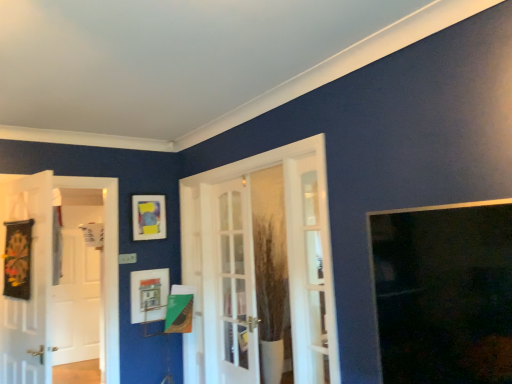
This screenshot has width=512, height=384. What do you see at coordinates (149, 295) in the screenshot? I see `matte white picture frame at center, acting as the first picture frame starting from the bottom` at bounding box center [149, 295].

Describe the element at coordinates (30, 280) in the screenshot. I see `black fabric banner at left, which is counted as the first door, starting from the left` at that location.

Measure the distance between point (42, 330) and camera.

They are 2.74 meters apart.

What do you see at coordinates (444, 294) in the screenshot?
I see `transparent glass window at upper right` at bounding box center [444, 294].

Measure the distance between matte plastic picture frame at upper left, which is the 1th picture frame in top-to-bottom order, and camera.

3.68 meters.

Identify the location of matte white picture frame at center, which is counted as the 2th picture frame, starting from the top. point(149,295).

Can you confirm if black fabric banner at left, which is the third door in right-to-left order, is taller than matte plastic picture frame at upper left, the 2th picture frame in the bottom-to-top sequence?

→ Yes, black fabric banner at left, which is the third door in right-to-left order, is taller than matte plastic picture frame at upper left, the 2th picture frame in the bottom-to-top sequence.

From the image's perspective, is black fabric banner at left, which is counted as the first door, starting from the left, under matte plastic picture frame at upper left, which is the 1th picture frame in top-to-bottom order?

Correct, black fabric banner at left, which is counted as the first door, starting from the left, appears lower than matte plastic picture frame at upper left, which is the 1th picture frame in top-to-bottom order, in the image.

Looking at this image, is matte plastic picture frame at upper left, which is the 1th picture frame in top-to-bottom order, surrounded by black fabric banner at left, which is the third door in right-to-left order?

No.

Is white glossy screen door at left wider than white glass door at center, the second door viewed from the left?

In fact, white glossy screen door at left might be narrower than white glass door at center, the second door viewed from the left.

Where is `screen door behind the white glass door at center, the second door viewed from the left`? screen door behind the white glass door at center, the second door viewed from the left is located at coordinates (80, 281).

Does point (81, 189) come farther from viewer compared to point (234, 283)?

That is True.

Is white glossy screen door at left oriented towards white glass door at center, the second door viewed from the left?

Yes, white glossy screen door at left is facing white glass door at center, the second door viewed from the left.

Is point (38, 291) positioned before point (72, 266)?

Yes, point (38, 291) is in front of point (72, 266).

From the image's perspective, is black fabric banner at left, which is counted as the first door, starting from the left, positioned above or below white glossy screen door at left?

black fabric banner at left, which is counted as the first door, starting from the left, is situated higher than white glossy screen door at left in the image.

The image size is (512, 384). What are the coordinates of `screen door below the black fabric banner at left, which is the third door in right-to-left order (from a real-world perspective)` in the screenshot? It's located at (80, 281).

Is transparent glass window at upper right to the left or to the right of matte plastic picture frame at upper left, which is the 1th picture frame in top-to-bottom order, in the image?

Based on their positions, transparent glass window at upper right is located to the right of matte plastic picture frame at upper left, which is the 1th picture frame in top-to-bottom order.

From the image's perspective, between transparent glass window at upper right and matte plastic picture frame at upper left, the 2th picture frame in the bottom-to-top sequence, who is located below?

transparent glass window at upper right is shown below in the image.

Find the location of `window that is under the matte plastic picture frame at upper left, which is the 1th picture frame in top-to-bottom order (from a real-world perspective)`. window that is under the matte plastic picture frame at upper left, which is the 1th picture frame in top-to-bottom order (from a real-world perspective) is located at coordinates click(x=444, y=294).

Considering the positions of objects white glass door at center, the third door in the left-to-right sequence, and white glass door at center, the second door viewed from the left, in the image provided, who is in front, white glass door at center, the third door in the left-to-right sequence, or white glass door at center, the second door viewed from the left,?

white glass door at center, the third door in the left-to-right sequence, is closer to the camera.

I want to click on door below the white glass door at center, the third door in the left-to-right sequence (from a real-world perspective), so click(234, 284).

Considering the positions of objects white glass door at center, the third door in the left-to-right sequence, and white glass door at center, the second door viewed from the left, in the image provided, who is more to the right, white glass door at center, the third door in the left-to-right sequence, or white glass door at center, the second door viewed from the left,?

white glass door at center, the third door in the left-to-right sequence, is more to the right.

In terms of width, does white glossy screen door at left look wider or thinner when compared to matte white picture frame at center, acting as the first picture frame starting from the bottom?

Considering their sizes, white glossy screen door at left looks slimmer than matte white picture frame at center, acting as the first picture frame starting from the bottom.

Is white glossy screen door at left completely or partially outside of matte white picture frame at center, which is counted as the 2th picture frame, starting from the top?

Indeed, white glossy screen door at left is completely outside matte white picture frame at center, which is counted as the 2th picture frame, starting from the top.

How much distance is there between white glossy screen door at left and matte white picture frame at center, which is counted as the 2th picture frame, starting from the top?

white glossy screen door at left and matte white picture frame at center, which is counted as the 2th picture frame, starting from the top, are 5.52 feet apart.

From a real-world perspective, is white glossy screen door at left positioned above or below matte white picture frame at center, which is counted as the 2th picture frame, starting from the top?

white glossy screen door at left is below matte white picture frame at center, which is counted as the 2th picture frame, starting from the top.

From a real-world perspective, is matte white picture frame at center, which is counted as the 2th picture frame, starting from the top, under transparent glass window at upper right?

Yes, from a real-world perspective, matte white picture frame at center, which is counted as the 2th picture frame, starting from the top, is below transparent glass window at upper right.

Do you think matte white picture frame at center, acting as the first picture frame starting from the bottom, is within transparent glass window at upper right, or outside of it?

matte white picture frame at center, acting as the first picture frame starting from the bottom, is spatially situated outside transparent glass window at upper right.

Can you tell me how much matte white picture frame at center, which is counted as the 2th picture frame, starting from the top, and transparent glass window at upper right differ in facing direction?

91.7 degrees separate the facing orientations of matte white picture frame at center, which is counted as the 2th picture frame, starting from the top, and transparent glass window at upper right.

Is matte white picture frame at center, which is counted as the 2th picture frame, starting from the top, behind transparent glass window at upper right?

Yes, it is.

The width and height of the screenshot is (512, 384). In order to click on the 2nd picture frame behind the black fabric banner at left, which is the third door in right-to-left order, starting your count from the anchor in this screenshot , I will do `click(148, 217)`.

In the image, there is a white glass door at center, the second door viewed from the left. Where is `screen door below it (from a real-world perspective)`? screen door below it (from a real-world perspective) is located at coordinates (80, 281).

From the image, which object appears to be nearer to white glass door at center, which is the 2th door in right-to-left order, matte plastic picture frame at upper left, the 2th picture frame in the bottom-to-top sequence, or matte white picture frame at center, acting as the first picture frame starting from the bottom?

matte white picture frame at center, acting as the first picture frame starting from the bottom.

Based on the photo, from the image, which object appears to be farther from matte white picture frame at center, which is counted as the 2th picture frame, starting from the top, white glossy screen door at left or black fabric banner at left, which is the third door in right-to-left order?

Based on the image, white glossy screen door at left appears to be further to matte white picture frame at center, which is counted as the 2th picture frame, starting from the top.

Estimate the real-world distances between objects in this image. Which object is further from transparent glass window at upper right, matte plastic picture frame at upper left, which is the 1th picture frame in top-to-bottom order, or white glass door at center, which is the 2th door in right-to-left order?

matte plastic picture frame at upper left, which is the 1th picture frame in top-to-bottom order.

Estimate the real-world distances between objects in this image. Which object is closer to matte white picture frame at center, which is counted as the 2th picture frame, starting from the top, white glass door at center, the second door viewed from the left, or white glass door at center, placed as the 1th door when sorted from right to left?

white glass door at center, the second door viewed from the left, is closer to matte white picture frame at center, which is counted as the 2th picture frame, starting from the top.

Which object lies further to the anchor point transparent glass window at upper right, black fabric banner at left, which is counted as the first door, starting from the left, or matte white picture frame at center, acting as the first picture frame starting from the bottom?

Among the two, matte white picture frame at center, acting as the first picture frame starting from the bottom, is located further to transparent glass window at upper right.

Considering their positions, is white glass door at center, the third door in the left-to-right sequence, positioned further to transparent glass window at upper right than matte white picture frame at center, acting as the first picture frame starting from the bottom?

Among the two, matte white picture frame at center, acting as the first picture frame starting from the bottom, is located further to transparent glass window at upper right.

Estimate the real-world distances between objects in this image. Which object is closer to black fabric banner at left, which is counted as the first door, starting from the left, white glass door at center, placed as the 1th door when sorted from right to left, or white glass door at center, which is the 2th door in right-to-left order?

white glass door at center, which is the 2th door in right-to-left order, lies closer to black fabric banner at left, which is counted as the first door, starting from the left, than the other object.

Estimate the real-world distances between objects in this image. Which object is further from white glass door at center, placed as the 1th door when sorted from right to left, matte white picture frame at center, acting as the first picture frame starting from the bottom, or white glossy screen door at left?

Among the two, white glossy screen door at left is located further to white glass door at center, placed as the 1th door when sorted from right to left.

Find the location of `picture frame positioned between transparent glass window at upper right and matte plastic picture frame at upper left, the 2th picture frame in the bottom-to-top sequence, from near to far`. picture frame positioned between transparent glass window at upper right and matte plastic picture frame at upper left, the 2th picture frame in the bottom-to-top sequence, from near to far is located at coordinates (149, 295).

At what (x,y) coordinates should I click in order to perform the action: click on picture frame between matte plastic picture frame at upper left, the 2th picture frame in the bottom-to-top sequence, and white glass door at center, which is the 2th door in right-to-left order. Please return your answer as a coordinate pair (x, y). This screenshot has width=512, height=384. Looking at the image, I should click on (149, 295).

Where is `picture frame located between matte white picture frame at center, acting as the first picture frame starting from the bottom, and white glossy screen door at left in the depth direction`? The width and height of the screenshot is (512, 384). picture frame located between matte white picture frame at center, acting as the first picture frame starting from the bottom, and white glossy screen door at left in the depth direction is located at coordinates (148, 217).

Locate an element on the screen. The height and width of the screenshot is (384, 512). door between black fabric banner at left, which is counted as the first door, starting from the left, and white glass door at center, placed as the 1th door when sorted from right to left, from left to right is located at coordinates (234, 284).